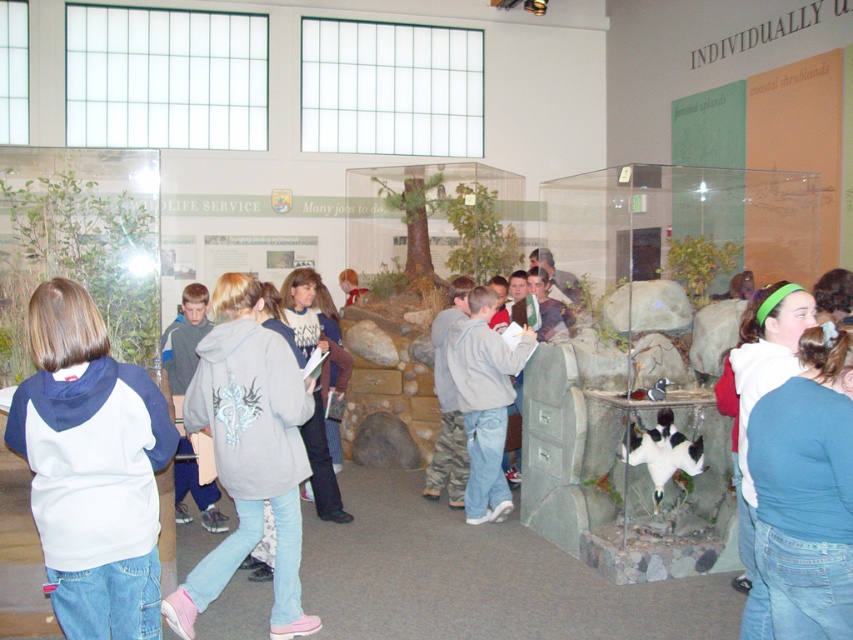
Does white fleece sweatshirt at center appear on the right side of gray matte hoodie at center?

Incorrect, white fleece sweatshirt at center is not on the right side of gray matte hoodie at center.

From the picture: Is white fleece sweatshirt at center to the left of gray matte hoodie at center from the viewer's perspective?

Yes, white fleece sweatshirt at center is to the left of gray matte hoodie at center.

Is point (57, 404) positioned in front of point (462, 339)?

Yes, it is.

You are a GUI agent. You are given a task and a screenshot of the screen. Output one action in this format:
    pyautogui.click(x=<x>, y=<y>)
    Task: Click on the white fleece sweatshirt at center
    
    Given the screenshot: What is the action you would take?
    pyautogui.click(x=91, y=468)

Does white fleece sweatshirt at center have a lesser width compared to light gray hoodie at center?

Indeed, white fleece sweatshirt at center has a lesser width compared to light gray hoodie at center.

Is point (109, 410) farther from camera compared to point (294, 426)?

That is False.

At what (x,y) coordinates should I click in order to perform the action: click on white fleece sweatshirt at center. Please return your answer as a coordinate pair (x, y). Looking at the image, I should click on (91, 468).

This screenshot has height=640, width=853. In order to click on white fleece sweatshirt at center in this screenshot , I will do `click(91, 468)`.

Which is behind, point (206, 593) or point (486, 307)?

Positioned behind is point (486, 307).

What do you see at coordinates (248, 452) in the screenshot?
I see `light gray hoodie at center` at bounding box center [248, 452].

Is point (242, 476) positioned after point (492, 403)?

No, (242, 476) is in front of (492, 403).

Locate an element on the screen. The height and width of the screenshot is (640, 853). light gray hoodie at center is located at coordinates (248, 452).